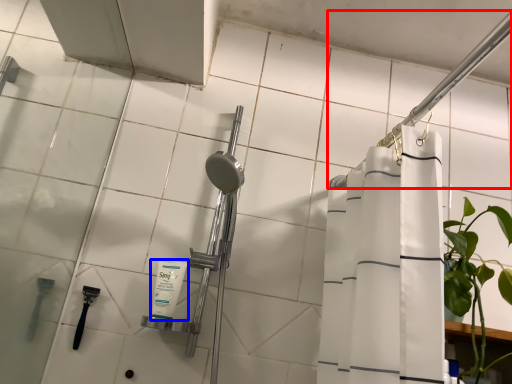
Question: Which object is further to the camera taking this photo, shower (highlighted by a red box) or toiletry (highlighted by a blue box)?

Choices:
 (A) shower
 (B) toiletry

Answer: (B)